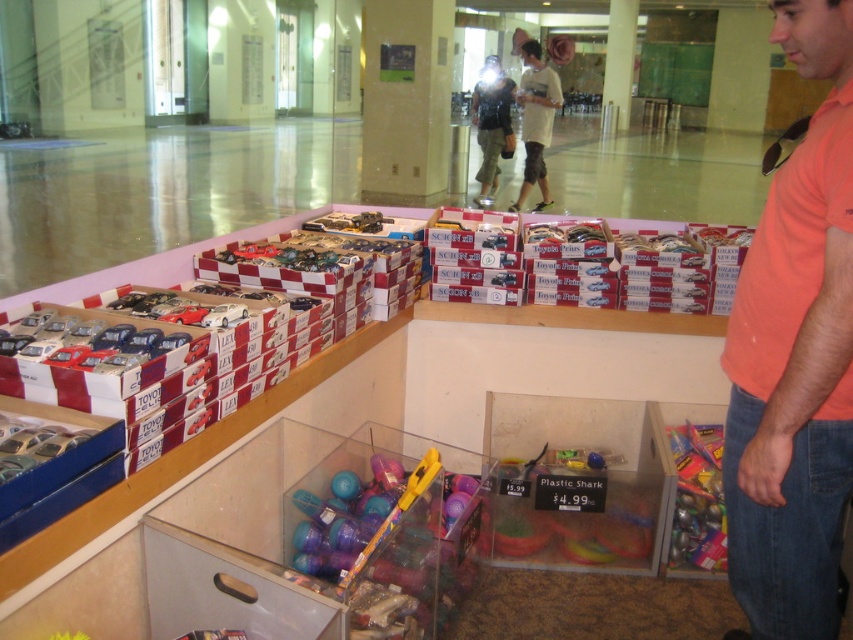
You are a store employee who needs to place a new item between the white cotton shirt at upper center and the matte black backpack at center. The new item is 12 inches wide. Can it fit in the space between them?

The space between the white cotton shirt at upper center and the matte black backpack at center is only 10.60 inches, which is narrower than the 12 inches width of the new item. Therefore, the item cannot fit in that space.

You are a customer at the mall and want to pick up the translucent plastic toy at lower right. However, there is a matte black backpack at center in the way. Can you reach the toy without moving the backpack?

The translucent plastic toy at lower right is below the matte black backpack at center, so you can reach it without moving the backpack since it is positioned underneath.

You are shopping for shirts and see an orange cotton shirt at right and a white cotton shirt at upper center. Which shirt is wider?

The white cotton shirt at upper center is wider than the orange cotton shirt at right.